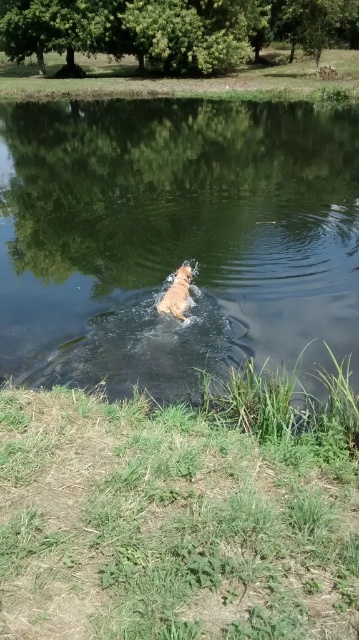
Question: Which object appears farthest from the camera in this image?

Choices:
 (A) golden fur dog at center
 (B) clear water at center

Answer: (A)

Question: Can you confirm if clear water at center is thinner than golden fur dog at center?

Choices:
 (A) yes
 (B) no

Answer: (B)

Question: Is clear water at center positioned behind golden fur dog at center?

Choices:
 (A) yes
 (B) no

Answer: (B)

Question: Which object is farther from the camera taking this photo?

Choices:
 (A) golden fur dog at center
 (B) clear water at center

Answer: (A)

Question: Does clear water at center appear on the right side of golden fur dog at center?

Choices:
 (A) no
 (B) yes

Answer: (A)

Question: Which point appears farthest from the camera in this image?

Choices:
 (A) pos(84,278)
 (B) pos(187,291)

Answer: (A)